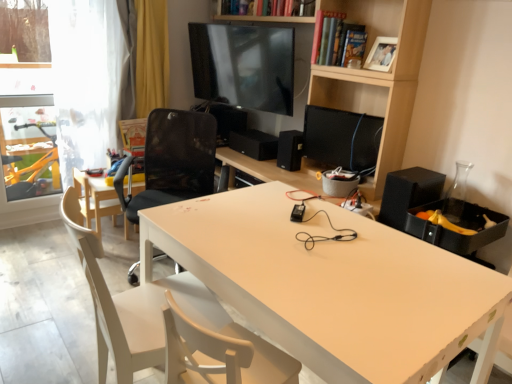
Question: Is hardcover book at upper center, positioned as the second book in right-to-left order, wider or thinner than black matte computer monitor at center?

Choices:
 (A) wide
 (B) thin

Answer: (A)

Question: From the image's perspective, is hardcover book at upper center, positioned as the second book in right-to-left order, located above or below black matte computer monitor at center?

Choices:
 (A) below
 (B) above

Answer: (B)

Question: Estimate the real-world distances between objects in this image. Which object is farther from the transparent glass door at left?

Choices:
 (A) light wood chair at left, which appears as the 3th chair when viewed from the front
 (B) hardcover book at upper center, the first book positioned from the right
 (C) white matte desk at center
 (D) black mesh chair at center, which is the second chair in front-to-back order
 (E) black matte speaker at center, marked as the first speaker in a left-to-right arrangement

Answer: (C)

Question: Estimate the real-world distances between objects in this image. Which object is closer to the black matte speaker at center, which is the 2th speaker in right-to-left order?

Choices:
 (A) black matte speaker at right, positioned as the 3th speaker in left-to-right order
 (B) hardcover book at upper center, the first book positioned from the right
 (C) black matte computer monitor at center
 (D) white wood chair at lower left, which is the 1th chair from front to back
 (E) transparent glass door at left

Answer: (C)